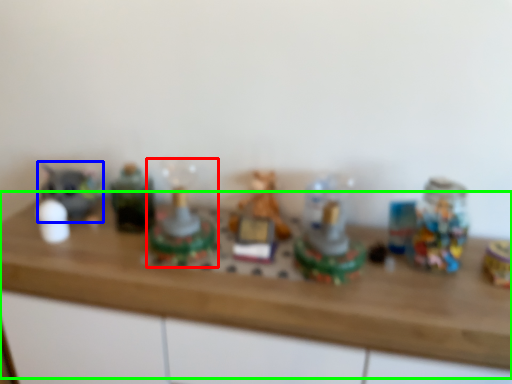
Question: Considering the real-world distances, which object is farthest from toy (highlighted by a red box)? toy (highlighted by a blue box) or counter top (highlighted by a green box)?

Choices:
 (A) toy
 (B) counter top

Answer: (A)